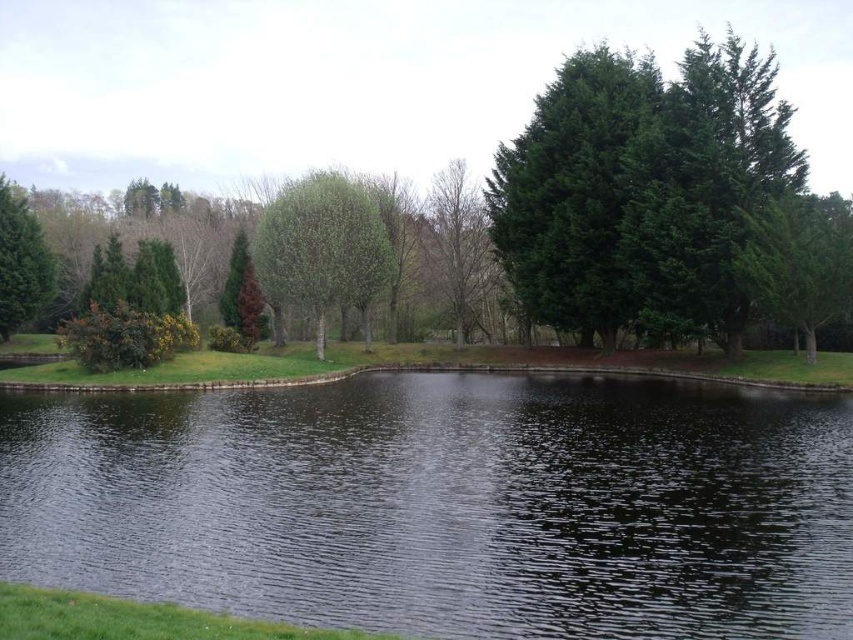
Who is more forward, (846,616) or (48,275)?

Point (846,616) is more forward.

Is dark reflective water at center taller than green matte tree at upper left?

No.

Which is in front, point (630, 481) or point (1, 237)?

Point (630, 481) is more forward.

The image size is (853, 640). Identify the location of dark reflective water at center. (445, 504).

You are a GUI agent. You are given a task and a screenshot of the screen. Output one action in this format:
    pyautogui.click(x=<x>, y=<y>)
    Task: Click on the dark reflective water at center
    Image resolution: width=853 pixels, height=640 pixels.
    Given the screenshot: What is the action you would take?
    pyautogui.click(x=445, y=504)

Who is more distant from viewer, (x=370, y=268) or (x=465, y=186)?

The point (x=465, y=186) is behind.

Where is `green leafy tree at center`? Image resolution: width=853 pixels, height=640 pixels. green leafy tree at center is located at coordinates (322, 246).